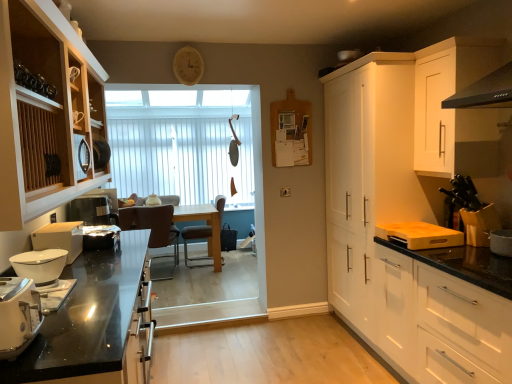
Question: Is brown leather chair at center positioned behind black glass countertop at lower left?

Choices:
 (A) no
 (B) yes

Answer: (B)

Question: Does brown leather chair at center have a greater width compared to black glass countertop at lower left?

Choices:
 (A) yes
 (B) no

Answer: (B)

Question: From a real-world perspective, is brown leather chair at center beneath black glass countertop at lower left?

Choices:
 (A) yes
 (B) no

Answer: (B)

Question: Can you confirm if brown leather chair at center is smaller than black glass countertop at lower left?

Choices:
 (A) yes
 (B) no

Answer: (A)

Question: Is brown leather chair at center facing away from black glass countertop at lower left?

Choices:
 (A) yes
 (B) no

Answer: (B)

Question: In the image, is white glossy bowl at left, positioned as the 1th kitchen appliance in back-to-front order, positioned in front of or behind white ceramic pot at right, the second appliance from the back?

Choices:
 (A) behind
 (B) front

Answer: (A)

Question: Is point (77, 253) positioned closer to the camera than point (508, 236)?

Choices:
 (A) closer
 (B) farther

Answer: (B)

Question: From a real-world perspective, is white glossy bowl at left, which is the 3th kitchen appliance in front-to-back order, above or below white ceramic pot at right, acting as the 1th appliance starting from the front?

Choices:
 (A) below
 (B) above

Answer: (B)

Question: Based on their positions, is white glossy bowl at left, which is the 3th kitchen appliance in front-to-back order, located to the left or right of white ceramic pot at right, the second appliance from the back?

Choices:
 (A) left
 (B) right

Answer: (A)

Question: Looking at the image, does wooden cabinet at left, placed as the 4th cabinetry when sorted from right to left, seem bigger or smaller compared to brown leather chair at center?

Choices:
 (A) big
 (B) small

Answer: (A)

Question: Choose the correct answer: Is wooden cabinet at left, placed as the 4th cabinetry when sorted from right to left, inside brown leather chair at center or outside it?

Choices:
 (A) inside
 (B) outside

Answer: (B)

Question: From their relative heights in the image, would you say wooden cabinet at left, which is the first cabinetry in left-to-right order, is taller or shorter than brown leather chair at center?

Choices:
 (A) short
 (B) tall

Answer: (A)

Question: Looking at their shapes, would you say wooden cabinet at left, which is the first cabinetry in left-to-right order, is wider or thinner than brown leather chair at center?

Choices:
 (A) thin
 (B) wide

Answer: (A)

Question: From a real-world perspective, is white matte cabinet at upper right, which is counted as the 1th cabinetry, starting from the right, above or below white matte cabinet at right, positioned as the 3th cabinetry in left-to-right order?

Choices:
 (A) below
 (B) above

Answer: (B)

Question: Choose the correct answer: Is white matte cabinet at upper right, which is counted as the 1th cabinetry, starting from the right, inside white matte cabinet at right, positioned as the 2th cabinetry in right-to-left order, or outside it?

Choices:
 (A) outside
 (B) inside

Answer: (A)